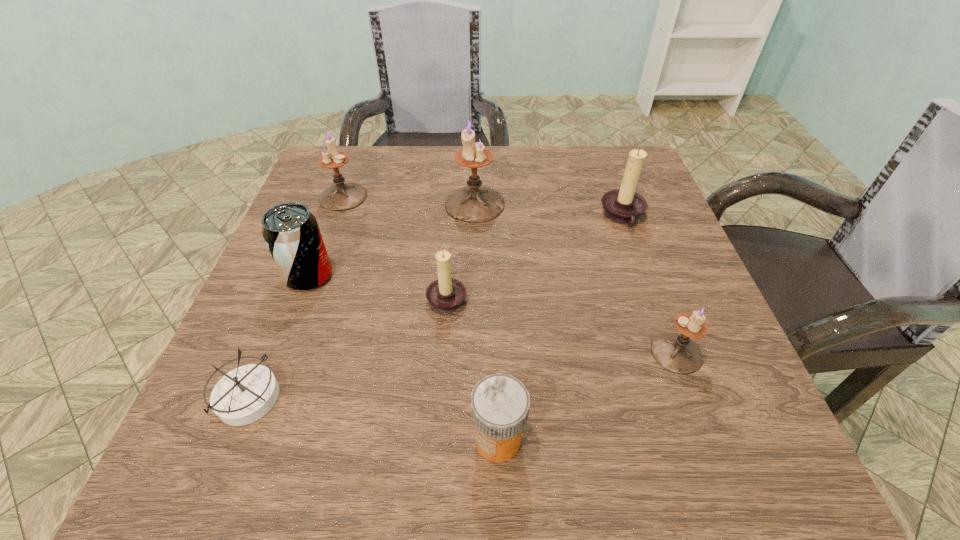
Identify the location of vacant area that lies between the right brown candle holder and the soda can. The image size is (960, 540). (466, 247).

Where is `vacant area that lies between the shortest object and the soda can`? vacant area that lies between the shortest object and the soda can is located at coordinates (279, 338).

Locate an element on the screen. vacant area that lies between the shortest object and the rightmost purple candle holder is located at coordinates (463, 376).

Find the location of a particular element. Image resolution: width=960 pixels, height=540 pixels. free spot between the nearer brown candle holder and the tallest candle holder is located at coordinates (461, 251).

Locate an element on the screen. Image resolution: width=960 pixels, height=540 pixels. free area in between the medicine and the farther brown candle holder is located at coordinates (561, 328).

Identify the location of free space that is in between the medicine and the nearest candle holder. (588, 396).

Find the location of a particular element. Image resolution: width=960 pixels, height=540 pixels. vacant space in between the rightmost purple candle holder and the farther brown candle holder is located at coordinates (650, 285).

The height and width of the screenshot is (540, 960). I want to click on blank region between the nearest candle holder and the tallest candle holder, so click(575, 279).

Identify the location of vacant area that lies between the soda can and the compass. (279, 338).

Locate which object ranks second in proximity to the smallest purple candle holder. Please provide its 2D coordinates. Your answer should be formatted as a tuple, i.e. [(x, y)], where the tuple contains the x and y coordinates of a point satisfying the conditions above.

[(624, 206)]